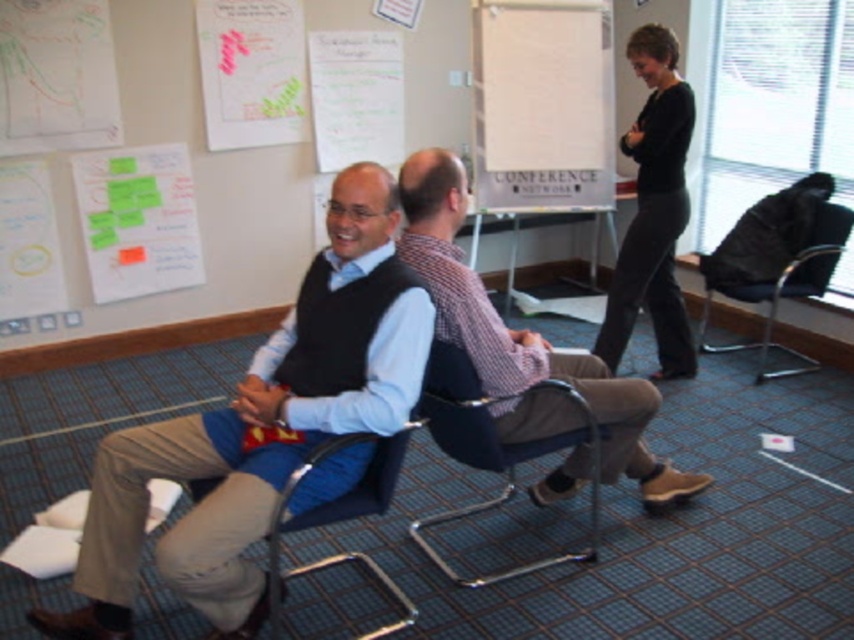
Between matte black vest at center and checkered fabric shirt at center, which one has more height?

matte black vest at center

Is point (287, 356) farther from camera compared to point (449, 228)?

No, (287, 356) is in front of (449, 228).

Where is `matte black vest at center`? matte black vest at center is located at coordinates (260, 428).

Who is taller, checkered fabric shirt at center or black mesh swivel chair at right?

checkered fabric shirt at center is taller.

What do you see at coordinates (521, 332) in the screenshot? The width and height of the screenshot is (854, 640). I see `checkered fabric shirt at center` at bounding box center [521, 332].

The height and width of the screenshot is (640, 854). Find the location of `checkered fabric shirt at center`. checkered fabric shirt at center is located at coordinates (521, 332).

Does matte black vest at center have a greater width compared to blue fabric chair at center?

Yes.

Between point (373, 184) and point (332, 516), which one is positioned behind?

Point (332, 516)

Where is `matte black vest at center`? This screenshot has width=854, height=640. matte black vest at center is located at coordinates (260, 428).

Identify the location of matte black vest at center. The height and width of the screenshot is (640, 854). (260, 428).